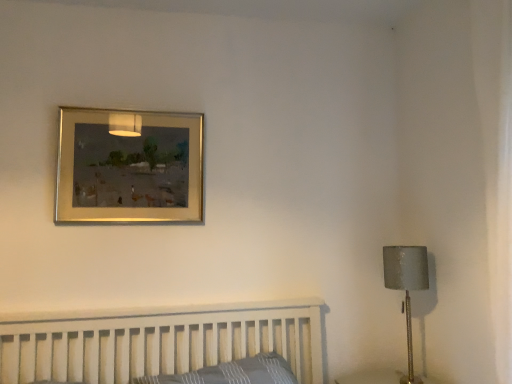
Question: From the image's perspective, is gold metallic picture frame at upper center on top of gray plaid pillow at lower center?

Choices:
 (A) yes
 (B) no

Answer: (A)

Question: Is gold metallic picture frame at upper center wider than gray plaid pillow at lower center?

Choices:
 (A) yes
 (B) no

Answer: (B)

Question: Is gold metallic picture frame at upper center behind gray plaid pillow at lower center?

Choices:
 (A) no
 (B) yes

Answer: (B)

Question: Does gold metallic picture frame at upper center have a greater height compared to gray plaid pillow at lower center?

Choices:
 (A) no
 (B) yes

Answer: (B)

Question: Is there a large distance between gold metallic picture frame at upper center and gray plaid pillow at lower center?

Choices:
 (A) yes
 (B) no

Answer: (B)

Question: Considering the positions of gray plaid pillow at lower center and gold metallic picture frame at upper center in the image, is gray plaid pillow at lower center wider or thinner than gold metallic picture frame at upper center?

Choices:
 (A) wide
 (B) thin

Answer: (A)

Question: In terms of height, does gray plaid pillow at lower center look taller or shorter compared to gold metallic picture frame at upper center?

Choices:
 (A) tall
 (B) short

Answer: (B)

Question: From a real-world perspective, relative to gold metallic picture frame at upper center, is gray plaid pillow at lower center vertically above or below?

Choices:
 (A) below
 (B) above

Answer: (A)

Question: Considering the positions of point (141, 382) and point (105, 119), is point (141, 382) closer or farther from the camera than point (105, 119)?

Choices:
 (A) farther
 (B) closer

Answer: (B)

Question: Is gold metallic picture frame at upper center bigger or smaller than gray plaid pillow at lower center?

Choices:
 (A) small
 (B) big

Answer: (A)

Question: Considering the positions of gold metallic picture frame at upper center and gray plaid pillow at lower center in the image, is gold metallic picture frame at upper center wider or thinner than gray plaid pillow at lower center?

Choices:
 (A) thin
 (B) wide

Answer: (A)

Question: Based on their positions, is gold metallic picture frame at upper center located to the left or right of gray plaid pillow at lower center?

Choices:
 (A) right
 (B) left

Answer: (B)

Question: Is gold metallic picture frame at upper center taller or shorter than gray plaid pillow at lower center?

Choices:
 (A) tall
 (B) short

Answer: (A)

Question: From the image's perspective, relative to matte gray lampshade at right, is gray plaid pillow at lower center above or below?

Choices:
 (A) above
 (B) below

Answer: (B)

Question: In the image, is gray plaid pillow at lower center positioned in front of or behind matte gray lampshade at right?

Choices:
 (A) front
 (B) behind

Answer: (A)